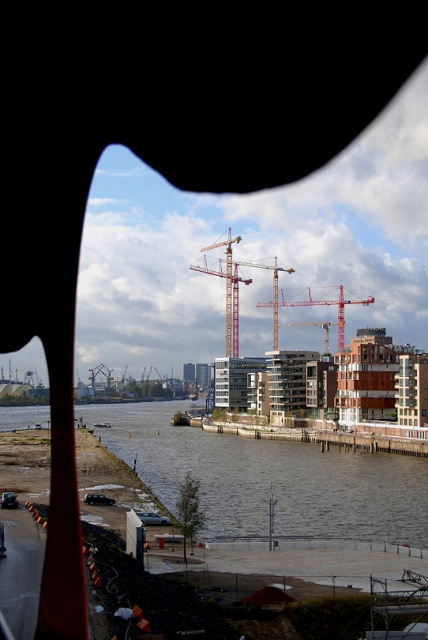
Does brown concrete river at lower center have a greater width compared to red metal crane at center?

Yes, brown concrete river at lower center is wider than red metal crane at center.

Which is in front, point (347, 484) or point (324, 333)?

Point (347, 484) is in front.

What are the coordinates of `brown concrete river at lower center` in the screenshot? It's located at (269, 477).

The height and width of the screenshot is (640, 428). What are the coordinates of `brown concrete river at lower center` in the screenshot? It's located at (269, 477).

Is the position of metallic construction crane at center more distant than that of red metal crane at center?

Yes.

Locate an element on the screen. Image resolution: width=428 pixels, height=640 pixels. metallic construction crane at center is located at coordinates (237, 291).

This screenshot has width=428, height=640. What are the coordinates of `metallic construction crane at center` in the screenshot? It's located at (237, 291).

Is brown concrete river at lower center further to camera compared to metallic construction crane at center?

No, brown concrete river at lower center is closer to the viewer.

Image resolution: width=428 pixels, height=640 pixels. What do you see at coordinates (269, 477) in the screenshot? I see `brown concrete river at lower center` at bounding box center [269, 477].

Between point (425, 532) and point (228, 321), which one is positioned in front?

Point (425, 532) is more forward.

Identify the location of brown concrete river at lower center. Image resolution: width=428 pixels, height=640 pixels. (269, 477).